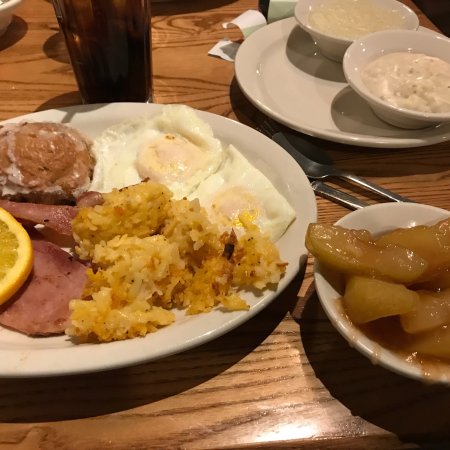
Image resolution: width=450 pixels, height=450 pixels. I want to click on spoon, so click(340, 170).